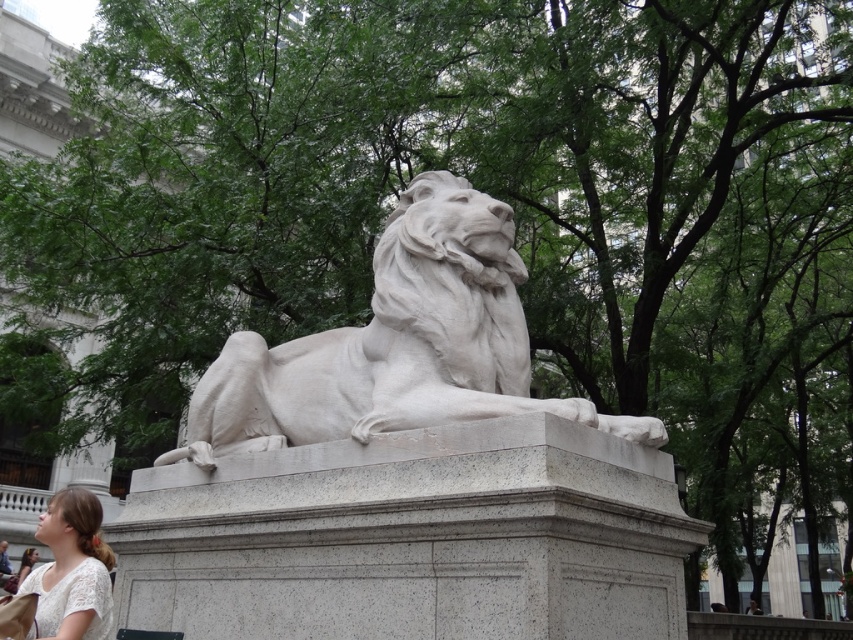
Can you confirm if white marble lion at center is smaller than light brown hair at lower left?

Actually, white marble lion at center might be larger than light brown hair at lower left.

Which of these two, white marble lion at center or light brown hair at lower left, stands taller?

Standing taller between the two is white marble lion at center.

Who is more distant from viewer, (425, 406) or (22, 572)?

Positioned behind is point (22, 572).

You are a GUI agent. You are given a task and a screenshot of the screen. Output one action in this format:
    pyautogui.click(x=<x>, y=<y>)
    Task: Click on the white marble lion at center
    
    Given the screenshot: What is the action you would take?
    pos(396,344)

Identify the location of white marble lion at center. This screenshot has width=853, height=640. (396, 344).

Is white marble lion at center bigger than white lace shirt at lower left?

Incorrect, white marble lion at center is not larger than white lace shirt at lower left.

Between point (341, 392) and point (76, 522), which one is positioned behind?

Point (341, 392)

The image size is (853, 640). Identify the location of white marble lion at center. (396, 344).

Find the location of a particular element. This screenshot has width=853, height=640. white lace shirt at lower left is located at coordinates (73, 570).